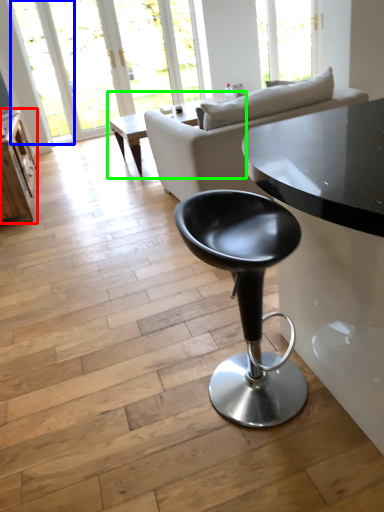
Question: Considering the real-world distances, which object is closest to table (highlighted by a red box)? window (highlighted by a blue box) or coffee table (highlighted by a green box).

Choices:
 (A) window
 (B) coffee table

Answer: (B)